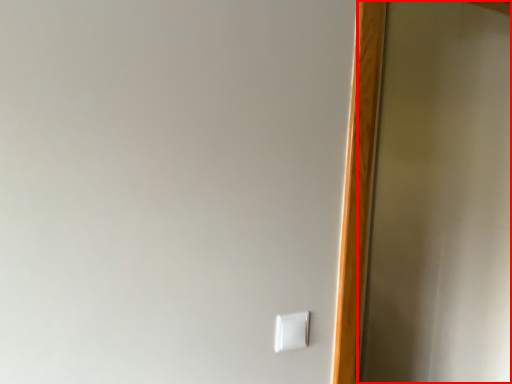
Question: In this image, where is screen door (annotated by the red box) located relative to light switch?

Choices:
 (A) left
 (B) right

Answer: (B)